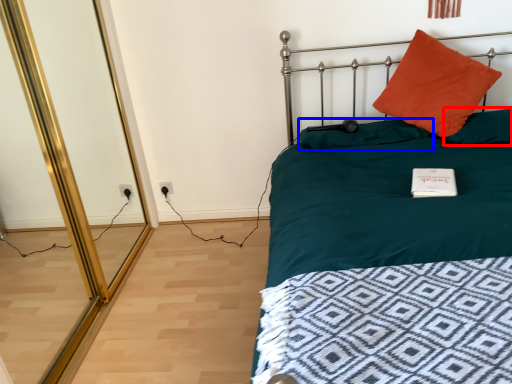
Question: Which object is closer to the camera taking this photo, pillow (highlighted by a red box) or pillow (highlighted by a blue box)?

Choices:
 (A) pillow
 (B) pillow

Answer: (A)